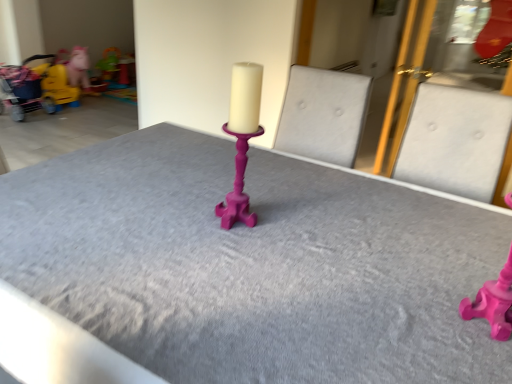
What is the approximate height of matte yellow toy at left, acting as the second toy starting from the top?

matte yellow toy at left, acting as the second toy starting from the top, is 16.03 inches tall.

In order to click on matte yellow toy at left, which is counted as the first toy, starting from the left in this screenshot , I will do `click(59, 87)`.

This screenshot has width=512, height=384. Identify the location of matte pink candlestick at center. coord(254,265).

From the image's perspective, relative to matte pink candlestick at center, is matte yellow toy at left, which is the 3th toy from right to left, above or below?

Based on their image positions, matte yellow toy at left, which is the 3th toy from right to left, is located above matte pink candlestick at center.

Is matte yellow toy at left, acting as the second toy starting from the top, not near matte pink candlestick at center?

matte yellow toy at left, acting as the second toy starting from the top, is far away from matte pink candlestick at center.

In the scene shown: Visually, is matte yellow toy at left, which is the 2th toy from back to front, positioned to the left or to the right of matte pink candlestick at center?

matte yellow toy at left, which is the 2th toy from back to front, is positioned on matte pink candlestick at center's left side.

Considering the relative sizes of matte yellow toy at left, acting as the second toy starting from the top, and matte pink candlestick at center in the image provided, is matte yellow toy at left, acting as the second toy starting from the top, thinner than matte pink candlestick at center?

Correct, the width of matte yellow toy at left, acting as the second toy starting from the top, is less than that of matte pink candlestick at center.

Based on the photo, which of these two, yellow fabric baby carriage at left or matte yellow plastic toy at upper left, the 1th toy positioned from the back, stands shorter?

matte yellow plastic toy at upper left, the 1th toy positioned from the back.

What's the angular difference between yellow fabric baby carriage at left and matte yellow plastic toy at upper left, marked as the third toy in a bottom-to-top arrangement,'s facing directions?

10.8 degrees separate the facing orientations of yellow fabric baby carriage at left and matte yellow plastic toy at upper left, marked as the third toy in a bottom-to-top arrangement.

Is yellow fabric baby carriage at left far away from matte yellow plastic toy at upper left, marked as the third toy in a bottom-to-top arrangement?

No, yellow fabric baby carriage at left is in close proximity to matte yellow plastic toy at upper left, marked as the third toy in a bottom-to-top arrangement.

Considering the positions of point (25, 63) and point (75, 70), is point (25, 63) closer or farther from the camera than point (75, 70)?

Point (25, 63) is positioned closer to the camera compared to point (75, 70).

In the image, is yellow fabric baby carriage at left on the left side or the right side of matte yellow toy at left, which is the 2th toy from back to front?

Clearly, yellow fabric baby carriage at left is on the left of matte yellow toy at left, which is the 2th toy from back to front, in the image.

Where is `the 2nd toy directly beneath the yellow fabric baby carriage at left (from a real-world perspective)`? the 2nd toy directly beneath the yellow fabric baby carriage at left (from a real-world perspective) is located at coordinates (59, 87).

What's the angular difference between yellow fabric baby carriage at left and matte yellow toy at left, which is the 2th toy from back to front,'s facing directions?

yellow fabric baby carriage at left and matte yellow toy at left, which is the 2th toy from back to front, are facing 1.03 degrees away from each other.

From the image's perspective, does yellow fabric baby carriage at left appear higher than matte yellow toy at left, which is counted as the first toy, starting from the left?

No.

Is yellow fabric baby carriage at left oriented towards matte pink candlestick at center, the 1th toy from the bottom?

No, yellow fabric baby carriage at left is not oriented towards matte pink candlestick at center, the 1th toy from the bottom.

Which point is more forward, [53,59] or [496,336]?

The point [496,336] is more forward.

Considering the positions of objects yellow fabric baby carriage at left and matte pink candlestick at center, which is the 3th toy in back-to-front order, in the image provided, who is more to the right, yellow fabric baby carriage at left or matte pink candlestick at center, which is the 3th toy in back-to-front order,?

From the viewer's perspective, matte pink candlestick at center, which is the 3th toy in back-to-front order, appears more on the right side.

Between matte yellow plastic toy at upper left, marked as the third toy in a bottom-to-top arrangement, and matte pink candlestick at center, which appears as the first toy when viewed from the right, which one appears on the left side from the viewer's perspective?

Positioned to the left is matte yellow plastic toy at upper left, marked as the third toy in a bottom-to-top arrangement.

From the image's perspective, is matte yellow plastic toy at upper left, the 2th toy from the left, above or below matte pink candlestick at center, marked as the 3th toy in a left-to-right arrangement?

Based on their image positions, matte yellow plastic toy at upper left, the 2th toy from the left, is located above matte pink candlestick at center, marked as the 3th toy in a left-to-right arrangement.

Is matte yellow plastic toy at upper left, the 1th toy positioned from the back, taller than matte pink candlestick at center, which appears as the first toy when viewed from the right?

Indeed, matte yellow plastic toy at upper left, the 1th toy positioned from the back, has a greater height compared to matte pink candlestick at center, which appears as the first toy when viewed from the right.

Which is correct: matte yellow plastic toy at upper left, the first toy from the top, is inside matte pink candlestick at center, which is the 3th toy in back-to-front order, or outside of it?

matte yellow plastic toy at upper left, the first toy from the top, is not inside matte pink candlestick at center, which is the 3th toy in back-to-front order, it's outside.

Can you confirm if yellow fabric baby carriage at left is taller than matte pink candlestick at center?

Incorrect, the height of yellow fabric baby carriage at left is not larger of that of matte pink candlestick at center.

Can you see yellow fabric baby carriage at left touching matte pink candlestick at center?

No.

In terms of size, does yellow fabric baby carriage at left appear bigger or smaller than matte pink candlestick at center?

Clearly, yellow fabric baby carriage at left is smaller in size than matte pink candlestick at center.

Is point (509, 318) less distant than point (50, 74)?

Yes.

Measure the distance from matte pink candlestick at center, the 1th toy from the bottom, to yellow fabric baby carriage at left.

They are 4.31 meters apart.

How different are the orientations of matte pink candlestick at center, marked as the 3th toy in a left-to-right arrangement, and yellow fabric baby carriage at left in degrees?

The facing directions of matte pink candlestick at center, marked as the 3th toy in a left-to-right arrangement, and yellow fabric baby carriage at left are 89.2 degrees apart.

Does matte pink candlestick at center, marked as the 3th toy in a left-to-right arrangement, turn towards yellow fabric baby carriage at left?

No, matte pink candlestick at center, marked as the 3th toy in a left-to-right arrangement, is not facing towards yellow fabric baby carriage at left.

Locate an element on the screen. table above the matte yellow toy at left, which is the 2th toy from back to front (from a real-world perspective) is located at coordinates (254, 265).

You are a GUI agent. You are given a task and a screenshot of the screen. Output one action in this format:
    pyautogui.click(x=<x>, y=<y>)
    Task: Click on the baby carriage in front of the matte yellow plastic toy at upper left, the 2th toy from the left
    The width and height of the screenshot is (512, 384).
    Given the screenshot: What is the action you would take?
    pyautogui.click(x=35, y=87)

Which object lies nearer to the anchor point matte yellow plastic toy at upper left, positioned as the third toy in front-to-back order, matte yellow toy at left, the second toy ordered from the bottom, or matte pink candlestick at center?

Based on the image, matte yellow toy at left, the second toy ordered from the bottom, appears to be nearer to matte yellow plastic toy at upper left, positioned as the third toy in front-to-back order.

Looking at the image, which one is located further to matte pink candlestick at center, marked as the 3th toy in a left-to-right arrangement, matte pink candlestick at center or matte yellow plastic toy at upper left, the 1th toy positioned from the back?

matte yellow plastic toy at upper left, the 1th toy positioned from the back.

Considering their positions, is yellow fabric baby carriage at left positioned closer to matte yellow plastic toy at upper left, positioned as the third toy in front-to-back order, than matte pink candlestick at center, marked as the 3th toy in a left-to-right arrangement?

yellow fabric baby carriage at left.

Which object lies nearer to the anchor point matte pink candlestick at center, yellow fabric baby carriage at left or matte yellow plastic toy at upper left, the first toy from the top?

yellow fabric baby carriage at left lies closer to matte pink candlestick at center than the other object.

Which object lies nearer to the anchor point matte yellow toy at left, which is the 2th toy from back to front, matte pink candlestick at center, which is the 3th toy in back-to-front order, or matte pink candlestick at center?

matte pink candlestick at center is closer to matte yellow toy at left, which is the 2th toy from back to front.

Estimate the real-world distances between objects in this image. Which object is closer to yellow fabric baby carriage at left, matte yellow toy at left, which is counted as the first toy, starting from the left, or matte pink candlestick at center, the 3th toy positioned from the top?

matte yellow toy at left, which is counted as the first toy, starting from the left, lies closer to yellow fabric baby carriage at left than the other object.

Which object lies further to the anchor point matte pink candlestick at center, the 3th toy positioned from the top, yellow fabric baby carriage at left or matte pink candlestick at center?

Based on the image, yellow fabric baby carriage at left appears to be further to matte pink candlestick at center, the 3th toy positioned from the top.

Considering their positions, is matte yellow toy at left, which is the 2th toy from back to front, positioned closer to matte pink candlestick at center than matte yellow plastic toy at upper left, marked as the third toy in a bottom-to-top arrangement?

The object closer to matte pink candlestick at center is matte yellow toy at left, which is the 2th toy from back to front.

Locate an element on the screen. This screenshot has height=384, width=512. toy positioned between yellow fabric baby carriage at left and matte yellow plastic toy at upper left, the 2th toy from the left, from near to far is located at coordinates (59, 87).

You are a GUI agent. You are given a task and a screenshot of the screen. Output one action in this format:
    pyautogui.click(x=<x>, y=<y>)
    Task: Click on the baby carriage between matte pink candlestick at center and matte yellow toy at left, which is the 2th toy from back to front, in the front-back direction
    
    Given the screenshot: What is the action you would take?
    pyautogui.click(x=35, y=87)

Locate an element on the screen. baby carriage positioned between matte pink candlestick at center, the 3th toy positioned from the top, and matte yellow toy at left, which appears as the 2th toy when viewed from the front, from near to far is located at coordinates (35, 87).

Locate an element on the screen. baby carriage between matte pink candlestick at center and matte yellow plastic toy at upper left, marked as the third toy in a bottom-to-top arrangement, in the front-back direction is located at coordinates (35, 87).